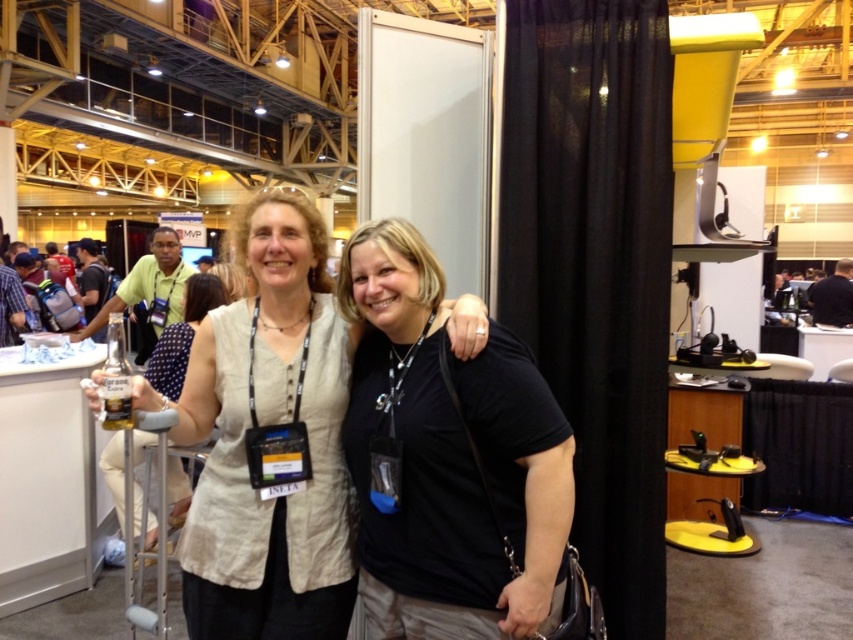
Describe the element at coordinates (595, 268) in the screenshot. The width and height of the screenshot is (853, 640). I see `black fabric curtain at center` at that location.

Can you confirm if black fabric curtain at center is shorter than black matte shirt at center?

Incorrect, black fabric curtain at center's height does not fall short of black matte shirt at center's.

This screenshot has width=853, height=640. What do you see at coordinates (595, 268) in the screenshot?
I see `black fabric curtain at center` at bounding box center [595, 268].

The width and height of the screenshot is (853, 640). I want to click on black fabric curtain at center, so click(x=595, y=268).

Is black fabric curtain at center positioned behind light blue shirt at center?

No, black fabric curtain at center is in front of light blue shirt at center.

Can you confirm if black fabric curtain at center is positioned to the left of light blue shirt at center?

In fact, black fabric curtain at center is to the right of light blue shirt at center.

What do you see at coordinates (595, 268) in the screenshot?
I see `black fabric curtain at center` at bounding box center [595, 268].

Locate an element on the screen. Image resolution: width=853 pixels, height=640 pixels. black fabric curtain at center is located at coordinates (595, 268).

Is black fabric curtain at center to the right of translucent plastic bottle at left from the viewer's perspective?

Correct, you'll find black fabric curtain at center to the right of translucent plastic bottle at left.

Between point (512, 152) and point (172, 371), which one is positioned in front?

Point (512, 152)

Where is `black fabric curtain at center`? black fabric curtain at center is located at coordinates (595, 268).